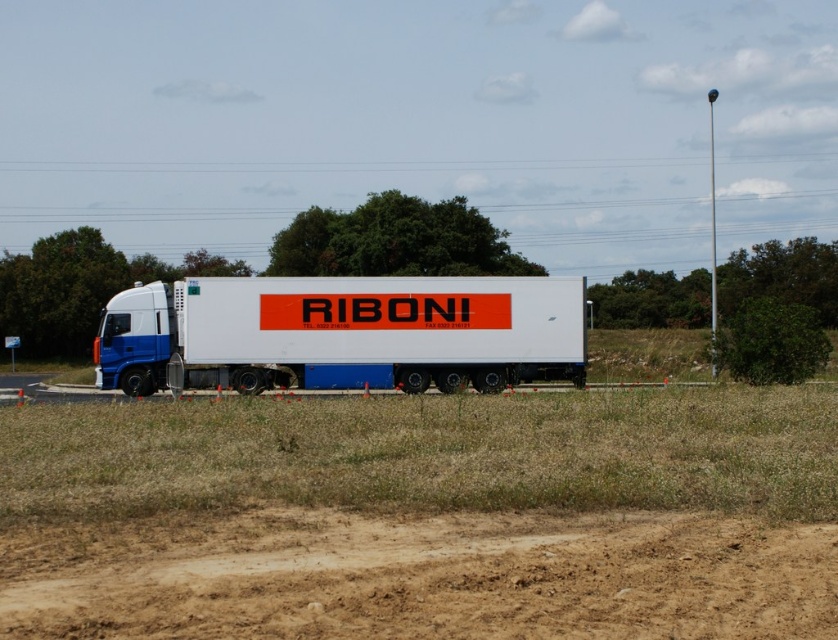
Which of these two, brown sandy dirt track at lower center or white matte trailer truck at center, stands taller?

With more height is white matte trailer truck at center.

Does point (645, 554) come in front of point (350, 310)?

That is True.

Image resolution: width=838 pixels, height=640 pixels. Identify the location of brown sandy dirt track at lower center. (422, 577).